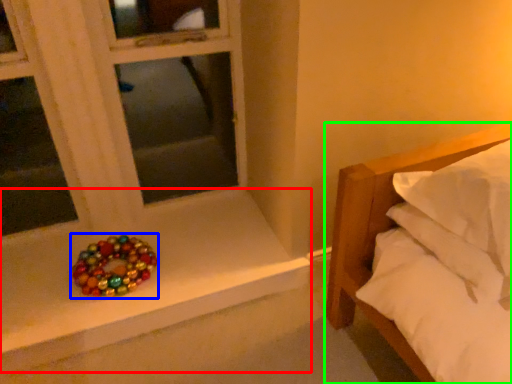
Question: Based on their relative distances, which object is farther from window sill (highlighted by a red box)? Choose from glass bead (highlighted by a blue box) and bed (highlighted by a green box).

Choices:
 (A) glass bead
 (B) bed

Answer: (B)